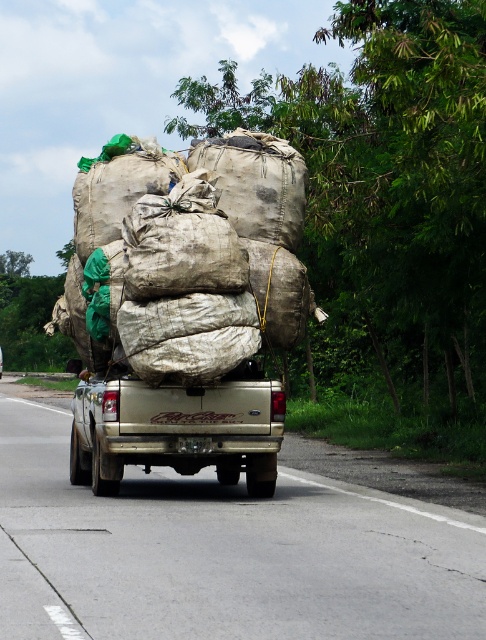
You are a traffic officer observing the road. You notice two trucks, a gold metallic truck at center and a gold matte truck at center. Which truck takes up more space on the road?

The gold metallic truck at center is larger in size than the gold matte truck at center, so it takes up more space on the road.

You are a delivery driver planning to pass another vehicle on a narrow two lane road. You see a gold metallic truck at center and a gold matte truck at center in your rearview mirror. Which truck should you be cautious about overtaking due to its width?

The gold metallic truck at center might be wider than gold matte truck at center, so you should be cautious about overtaking the gold metallic truck at center due to its potential width.

You are a pedestrian standing on the side of the road. You see the gold metallic truck at center and the gold matte truck at center. Which truck is closer to the ground?

The gold metallic truck at center is located below gold matte truck at center, so it is closer to the ground.